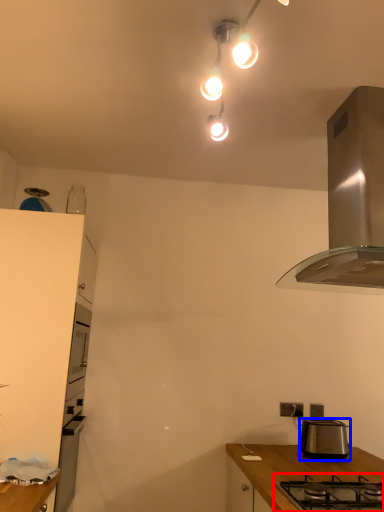
Question: Among these objects, which one is nearest to the camera, gas stove (highlighted by a red box) or toaster (highlighted by a blue box)?

Choices:
 (A) gas stove
 (B) toaster

Answer: (A)